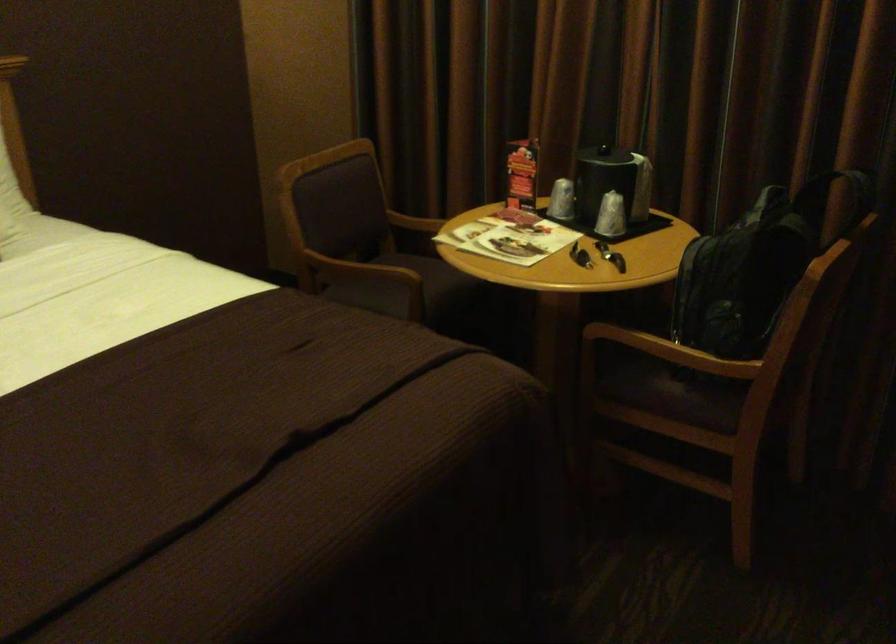
What are the coordinates of `ice bucket lid knob` in the screenshot? It's located at (612, 158).